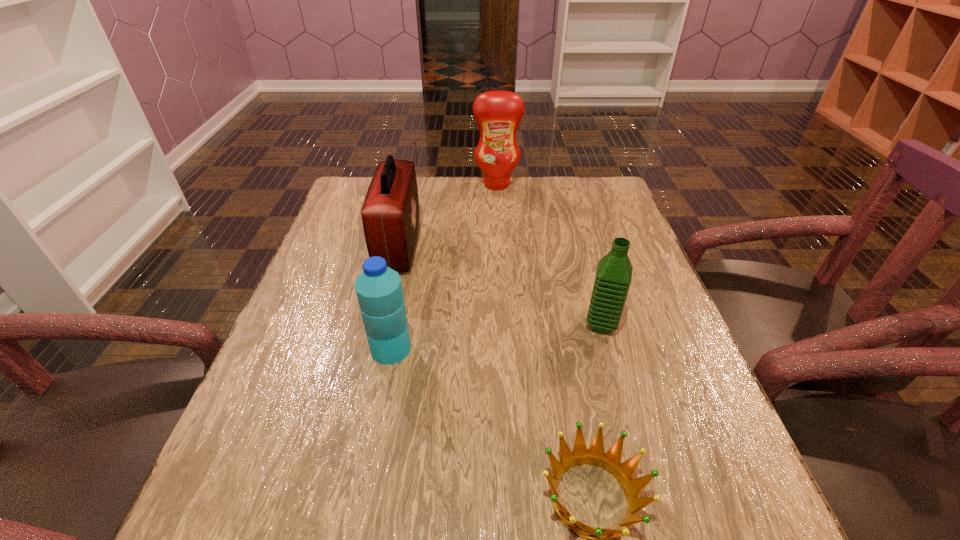
I want to click on condiment, so click(x=498, y=113).

Find the location of a particular element. The width and height of the screenshot is (960, 540). the tallest object is located at coordinates (498, 113).

You are a GUI agent. You are given a task and a screenshot of the screen. Output one action in this format:
    pyautogui.click(x=<x>, y=<y>)
    Task: Click on the first aid kit
    This screenshot has height=540, width=960.
    Given the screenshot: What is the action you would take?
    pyautogui.click(x=390, y=214)

This screenshot has height=540, width=960. In order to click on the left water bottle in this screenshot , I will do `click(379, 291)`.

You are a GUI agent. You are given a task and a screenshot of the screen. Output one action in this format:
    pyautogui.click(x=<x>, y=<y>)
    Task: Click on the right water bottle
    This screenshot has width=960, height=540.
    Given the screenshot: What is the action you would take?
    pyautogui.click(x=613, y=277)

Identify the location of vacant space located on the label side of the farthest object. This screenshot has height=540, width=960. (501, 267).

Locate an element on the screen. The width and height of the screenshot is (960, 540). free space located on the side of the first aid kit with the cross symbol is located at coordinates (479, 246).

This screenshot has height=540, width=960. In order to click on free space located 0.100m on the back of the left water bottle in this screenshot , I will do `click(400, 300)`.

You are a GUI agent. You are given a task and a screenshot of the screen. Output one action in this format:
    pyautogui.click(x=<x>, y=<y>)
    Task: Click on the free spot located on the back of the right water bottle
    
    Given the screenshot: What is the action you would take?
    pyautogui.click(x=570, y=214)

Image resolution: width=960 pixels, height=540 pixels. In order to click on object at the far edge in this screenshot , I will do `click(498, 113)`.